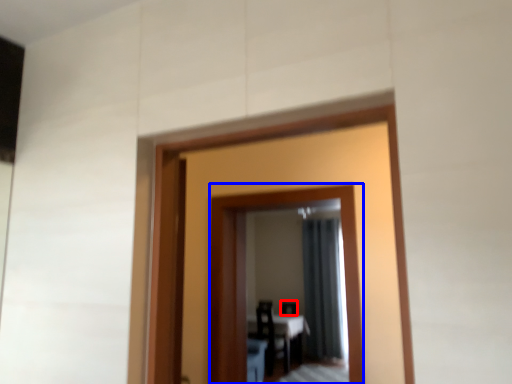
Question: Which point is closer to the camera, chair (highlighted by a red box) or mirror (highlighted by a blue box)?

Choices:
 (A) chair
 (B) mirror

Answer: (B)